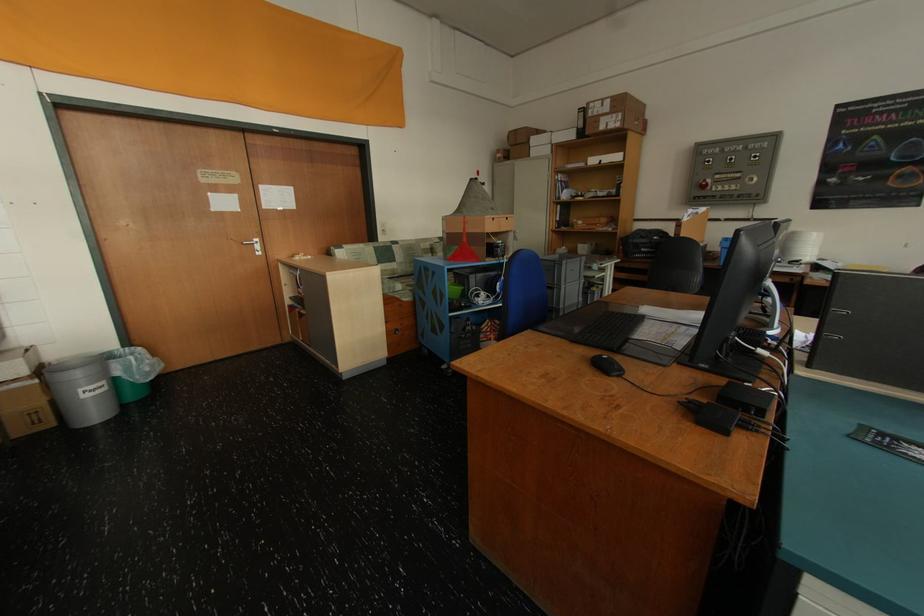
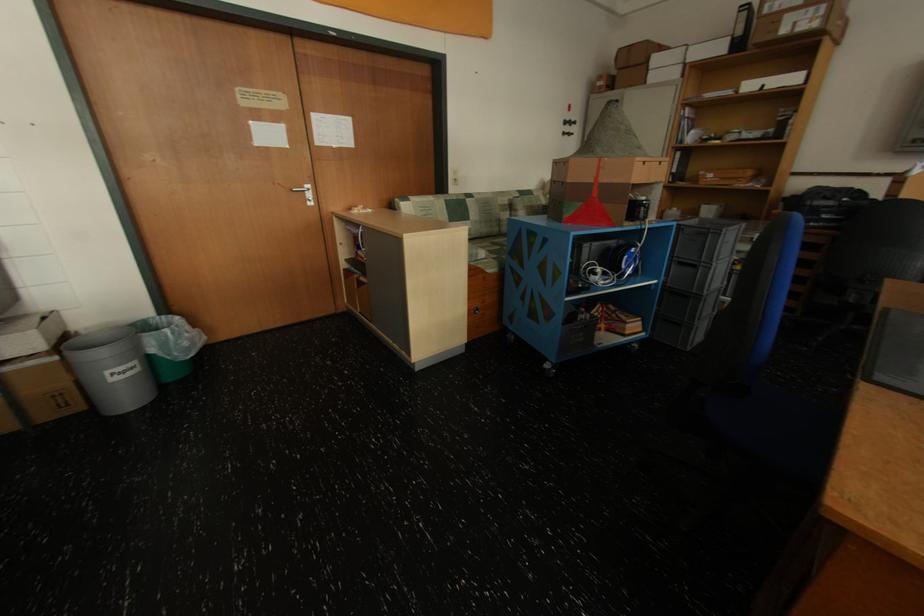
Find the pixel in the second image that matches point (402, 246) in the first image.

(476, 201)